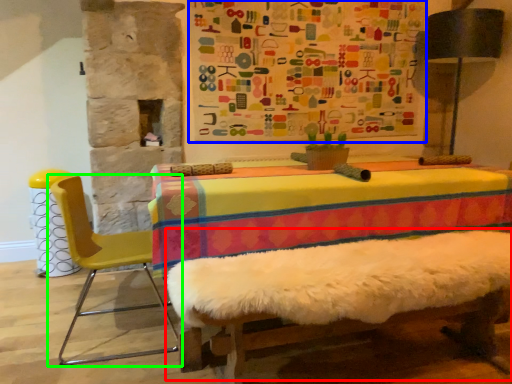
Question: Which object is positioned farthest from bed frame (highlighted by a red box)? Select from bulletin board (highlighted by a blue box) and chair (highlighted by a green box).

Choices:
 (A) bulletin board
 (B) chair

Answer: (A)